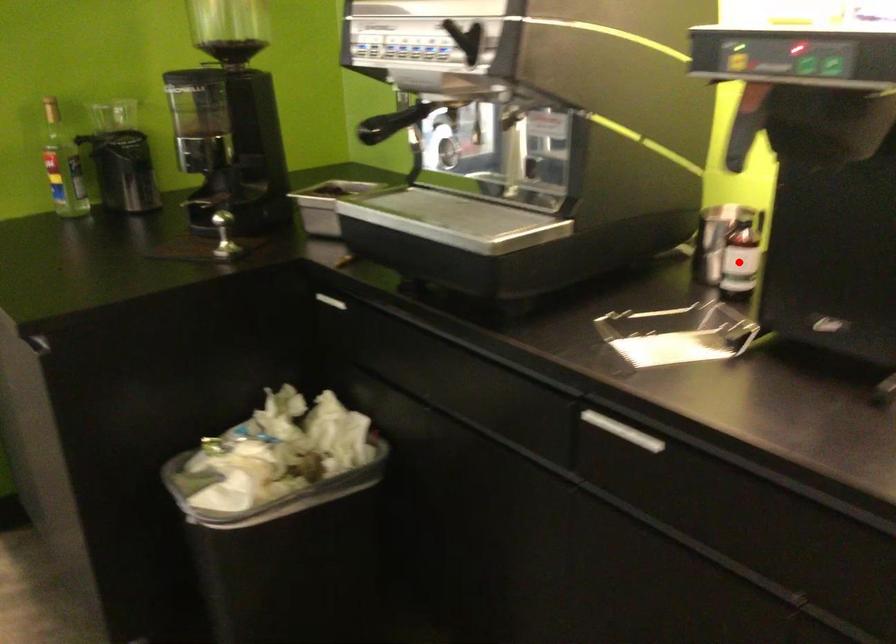
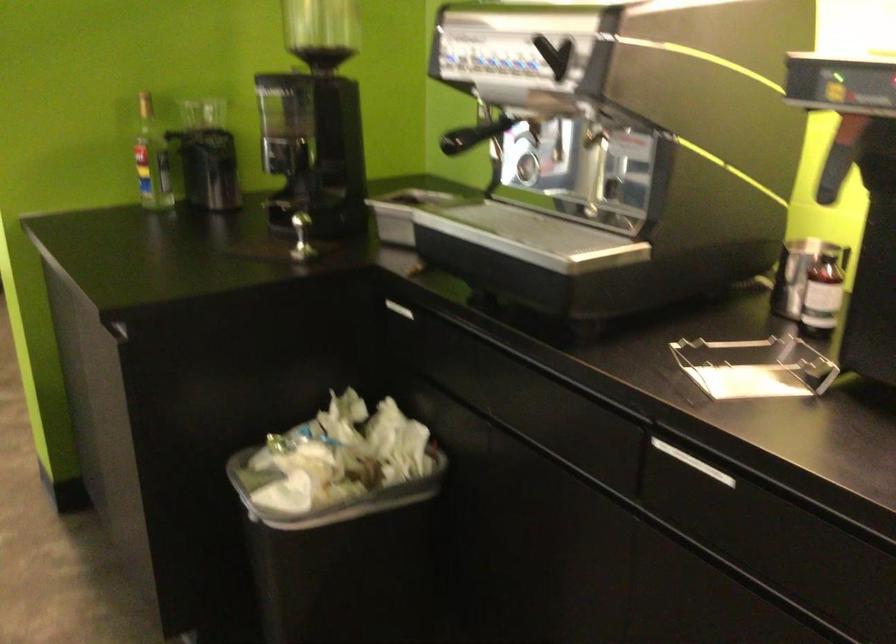
The point at the highlighted location is marked in the first image. Where is the corresponding point in the second image?

(822, 294)